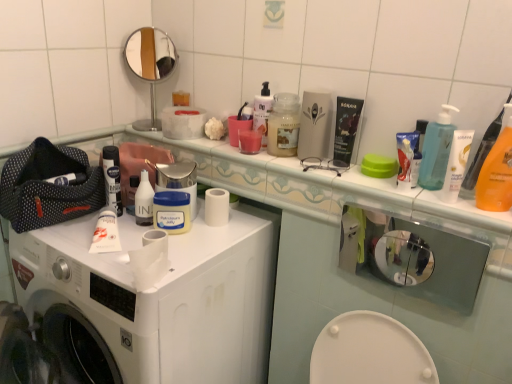
I want to click on free space to the left of metallic silver glasses at upper center, so click(274, 162).